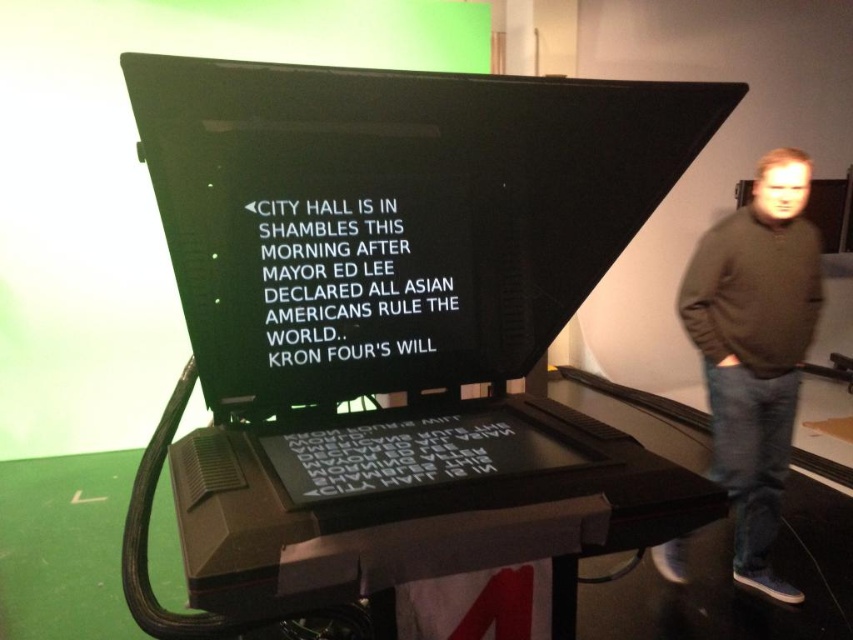
Question: Which object appears farthest from the camera in this image?

Choices:
 (A) black plastic computer screen at center
 (B) brown sweater at right

Answer: (B)

Question: Which of the following is the closest to the observer?

Choices:
 (A) (254, 118)
 (B) (770, 278)

Answer: (A)

Question: Is black plastic computer screen at center thinner than brown sweater at right?

Choices:
 (A) no
 (B) yes

Answer: (A)

Question: Does black plastic computer screen at center appear on the left side of brown sweater at right?

Choices:
 (A) no
 (B) yes

Answer: (B)

Question: Is black plastic computer screen at center below brown sweater at right?

Choices:
 (A) yes
 (B) no

Answer: (B)